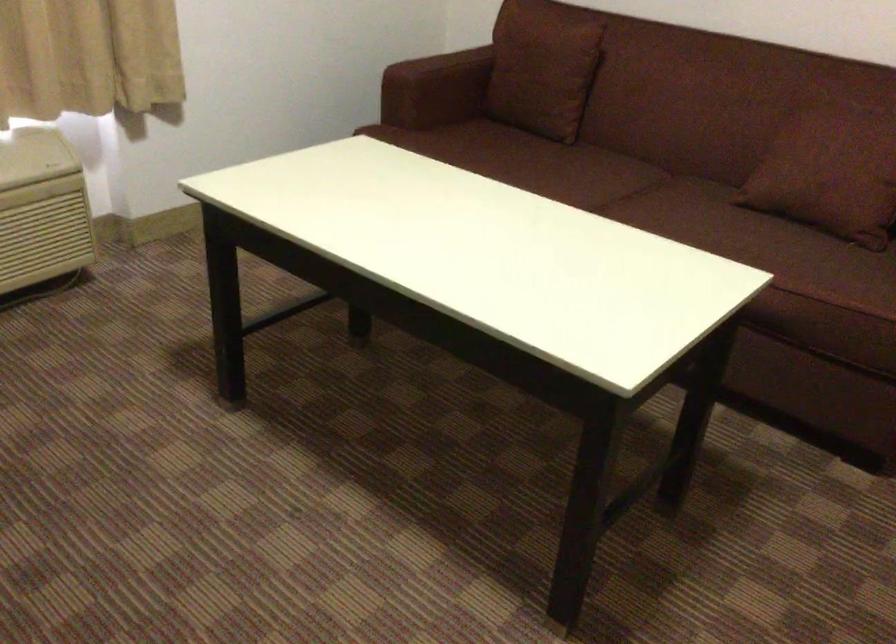
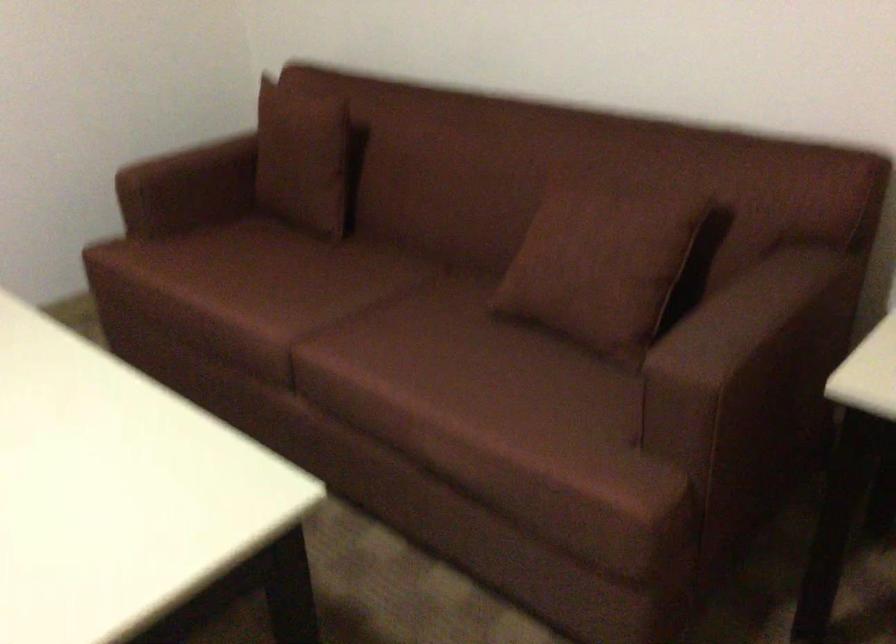
The point at [556,67] is marked in the first image. Where is the corresponding point in the second image?

(306, 158)